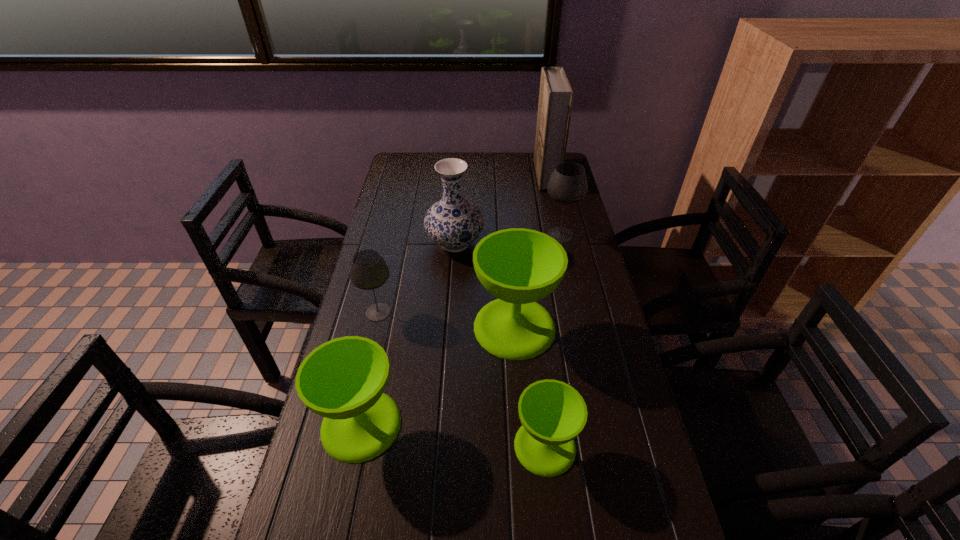
Identify the location of object present at the far edge. (556, 95).

You are a GUI agent. You are given a task and a screenshot of the screen. Output one action in this format:
    pyautogui.click(x=<x>, y=<y>)
    Task: Click on the phonebook situated at the right edge
    This screenshot has width=960, height=540.
    Given the screenshot: What is the action you would take?
    pyautogui.click(x=556, y=95)

Where is `object at the far right corner`? This screenshot has width=960, height=540. object at the far right corner is located at coordinates (556, 95).

In the image, there is a desktop. At what (x,y) coordinates should I click in order to perform the action: click on blank space at the far edge. Please return your answer as a coordinate pair (x, y). This screenshot has width=960, height=540. Looking at the image, I should click on (489, 167).

Where is `free space at the left edge of the desktop`? free space at the left edge of the desktop is located at coordinates (417, 233).

The image size is (960, 540). Identify the location of free space at the right edge of the desktop. (579, 310).

Image resolution: width=960 pixels, height=540 pixels. In the image, there is a desktop. In order to click on vacant space at the far left corner in this screenshot , I will do `click(399, 171)`.

The image size is (960, 540). Identify the location of vacant space that is in between the smallest green wineglass and the second smallest green wineglass. (453, 435).

I want to click on unoccupied area between the leftmost green wineglass and the right gray wineglass, so click(461, 330).

Find the location of a particular element. object that stands as the fourth closest to the phonebook is located at coordinates click(x=368, y=271).